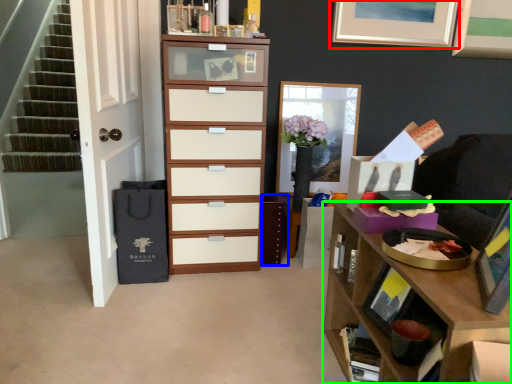
Question: Which object is positioned farthest from picture frame (highlighted by a red box)? Select from cabinetry (highlighted by a blue box) and desk (highlighted by a green box).

Choices:
 (A) cabinetry
 (B) desk

Answer: (B)